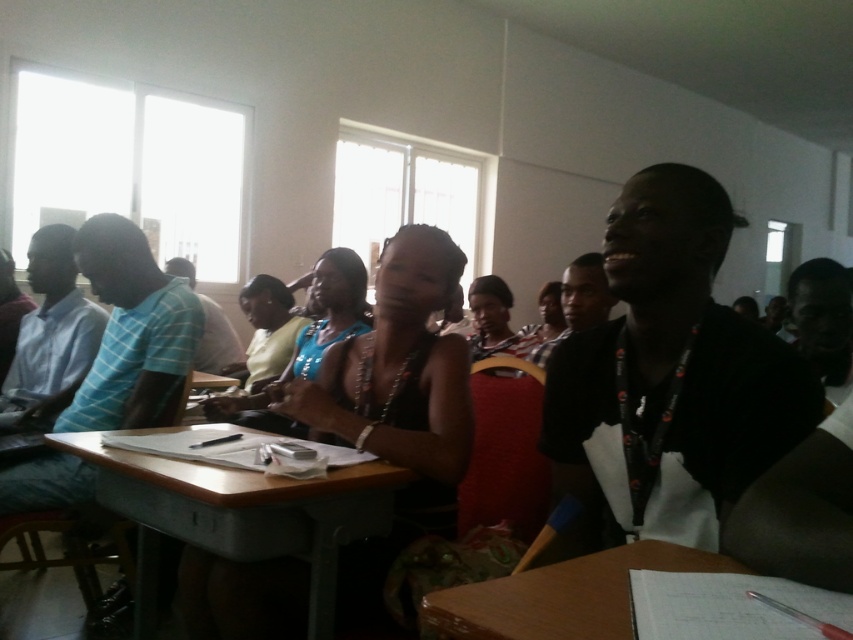
Measure the distance between black matte tank top at center and camera.

black matte tank top at center is 1.34 meters away from camera.

Does black matte tank top at center have a smaller size compared to wooden desk at center?

Yes.

Where is `black matte tank top at center`? black matte tank top at center is located at coordinates (396, 403).

Does wooden desk at center appear under matte black tank top at center?

Yes.

Is wooden desk at center above matte black tank top at center?

Incorrect, wooden desk at center is not positioned above matte black tank top at center.

Which is behind, point (163, 506) or point (537, 305)?

Positioned behind is point (537, 305).

Locate an element on the screen. Image resolution: width=853 pixels, height=640 pixels. wooden desk at center is located at coordinates (238, 513).

Is point (616, 356) positioned before point (346, 278)?

That is True.

Find the location of a particular element. The height and width of the screenshot is (640, 853). black fabric shirt at right is located at coordinates (666, 380).